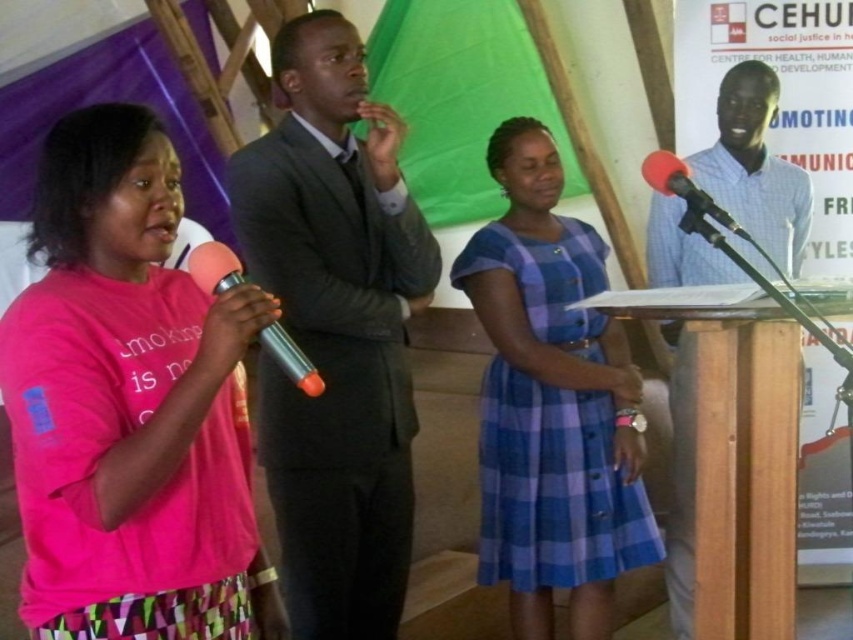
You are at the back of the room and want to take a photo of the speaker. There are two points marked in the image at coordinates point (x=361, y=572) and point (x=271, y=332). Which point is closer to you when aiming your camera?

Point (x=361, y=572) is further to the camera than point (x=271, y=332), so the closer point to you when aiming your camera is point (x=271, y=332).